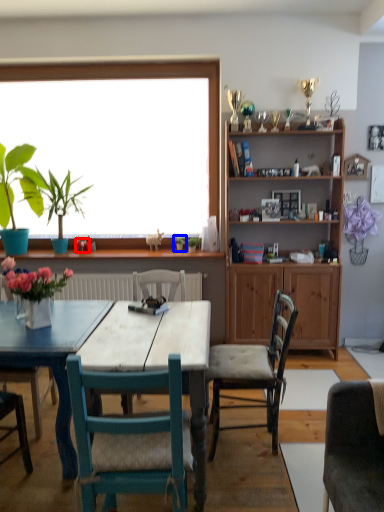
Question: Which of the following is the closest to the observer, flower (highlighted by a red box) or plant (highlighted by a blue box)?

Choices:
 (A) flower
 (B) plant

Answer: (A)